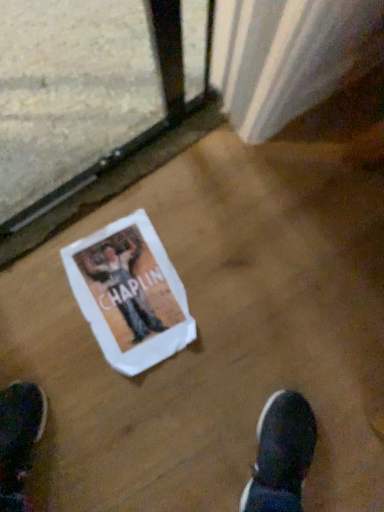
Identify the location of vacant area situated below white paper flyer at center (from a real-world perspective). This screenshot has height=512, width=384. (131, 296).